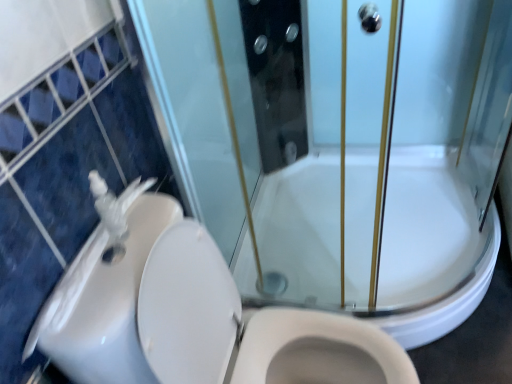
Question: Is white glossy sink at left placed right next to white glossy toilet at lower left?

Choices:
 (A) yes
 (B) no

Answer: (A)

Question: Is white glossy sink at left closer to the viewer compared to white glossy toilet at lower left?

Choices:
 (A) yes
 (B) no

Answer: (B)

Question: From a real-world perspective, does white glossy sink at left stand above white glossy toilet at lower left?

Choices:
 (A) yes
 (B) no

Answer: (A)

Question: Is white glossy sink at left smaller than white glossy toilet at lower left?

Choices:
 (A) no
 (B) yes

Answer: (B)

Question: Is white glossy sink at left bigger than white glossy toilet at lower left?

Choices:
 (A) yes
 (B) no

Answer: (B)

Question: Relative to white glossy sink at left, is white glossy toilet at lower left in front or behind?

Choices:
 (A) front
 (B) behind

Answer: (A)

Question: From the image's perspective, is white glossy toilet at lower left above or below white glossy sink at left?

Choices:
 (A) below
 (B) above

Answer: (A)

Question: Is point (317, 332) positioned closer to the camera than point (100, 347)?

Choices:
 (A) closer
 (B) farther

Answer: (B)

Question: Considering the positions of white glossy toilet at lower left and white glossy sink at left in the image, is white glossy toilet at lower left taller or shorter than white glossy sink at left?

Choices:
 (A) tall
 (B) short

Answer: (A)

Question: Is white glossy toilet at lower left situated inside white glossy bath at center or outside?

Choices:
 (A) inside
 (B) outside

Answer: (B)

Question: From the image's perspective, is white glossy toilet at lower left located above or below white glossy bath at center?

Choices:
 (A) above
 (B) below

Answer: (B)

Question: From a real-world perspective, is white glossy toilet at lower left positioned above or below white glossy bath at center?

Choices:
 (A) below
 (B) above

Answer: (B)

Question: Considering the positions of white glossy toilet at lower left and white glossy bath at center in the image, is white glossy toilet at lower left bigger or smaller than white glossy bath at center?

Choices:
 (A) big
 (B) small

Answer: (A)

Question: From a real-world perspective, relative to white glossy sink at left, is white glossy bath at center vertically above or below?

Choices:
 (A) below
 (B) above

Answer: (A)

Question: From the image's perspective, relative to white glossy sink at left, is white glossy bath at center above or below?

Choices:
 (A) above
 (B) below

Answer: (B)